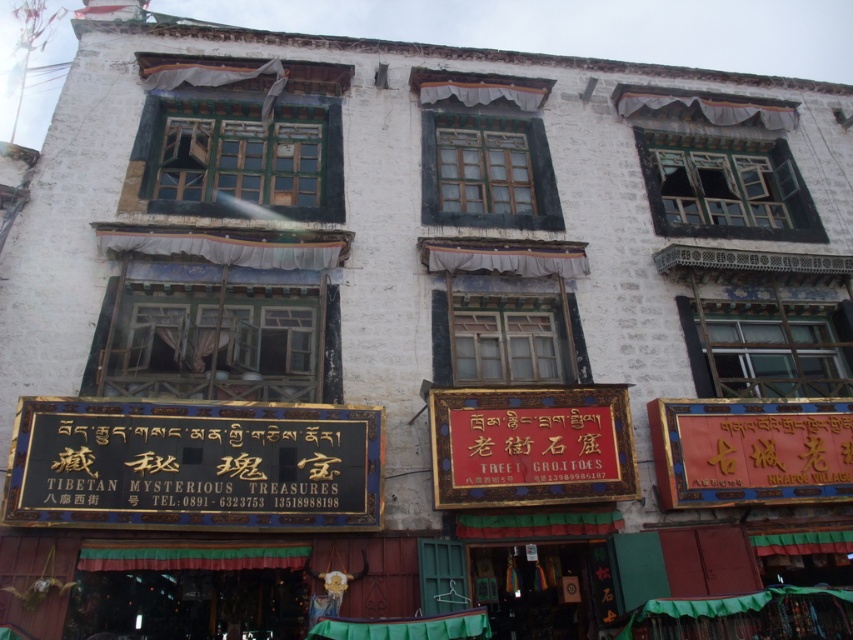
Which of these two, gold-gilded wood signboard at lower left or red glossy signboard at right, stands shorter?

red glossy signboard at right is shorter.

Which is above, gold-gilded wood signboard at lower left or red glossy signboard at right?

Positioned higher is gold-gilded wood signboard at lower left.

Which is behind, point (329, 468) or point (703, 424)?

Positioned behind is point (703, 424).

Locate an element on the screen. gold-gilded wood signboard at lower left is located at coordinates (194, 465).

Is gold metallic signboard at center closer to camera compared to red glossy signboard at right?

Yes, gold metallic signboard at center is closer to the viewer.

Is gold metallic signboard at center behind red glossy signboard at right?

No, gold metallic signboard at center is in front of red glossy signboard at right.

Is point (503, 452) positioned after point (798, 419)?

No, it is not.

Identify the location of gold metallic signboard at center. This screenshot has width=853, height=640. (531, 445).

Can you confirm if gold-gilded wood signboard at lower left is wider than gold metallic signboard at center?

Yes.

Who is positioned more to the right, gold-gilded wood signboard at lower left or gold metallic signboard at center?

gold metallic signboard at center

Identify the location of gold-gilded wood signboard at lower left. (194, 465).

At what (x,y) coordinates should I click in order to perform the action: click on gold-gilded wood signboard at lower left. Please return your answer as a coordinate pair (x, y). Looking at the image, I should click on (194, 465).